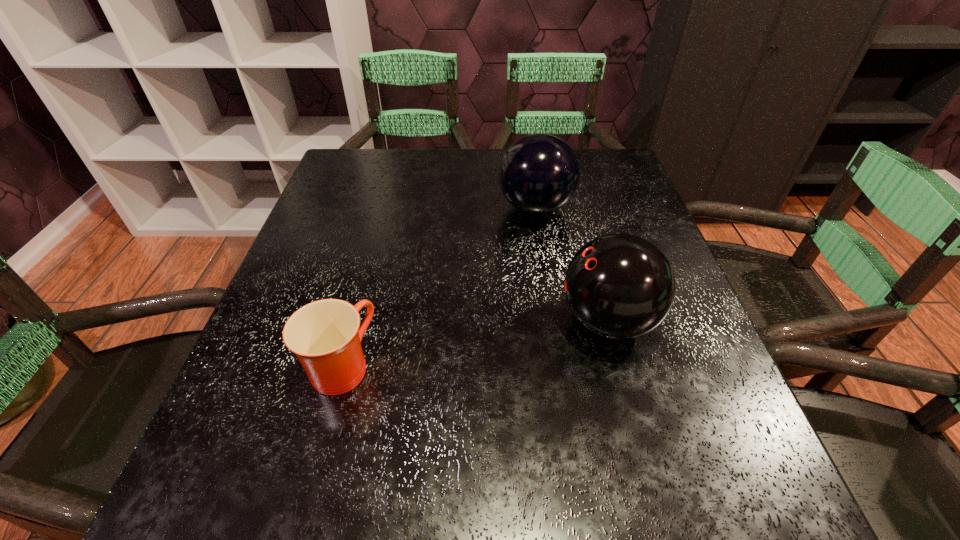
At what (x,y) coordinates should I click in order to perform the action: click on vacant area located 0.400m on the back of the leftmost object. Please return your answer as a coordinate pair (x, y). This screenshot has width=960, height=540. Looking at the image, I should click on (385, 205).

I want to click on object that is at the far edge, so click(x=539, y=173).

At what (x,y) coordinates should I click in order to perform the action: click on object that is positioned at the left edge. Please return your answer as a coordinate pair (x, y). This screenshot has width=960, height=540. Looking at the image, I should click on (325, 335).

Where is `object positioned at the right edge`? The width and height of the screenshot is (960, 540). object positioned at the right edge is located at coordinates (620, 286).

In the image, there is a desktop. Identify the location of free space at the far edge. This screenshot has height=540, width=960. (458, 169).

Locate an element on the screen. This screenshot has height=540, width=960. free space at the near edge of the desktop is located at coordinates (655, 535).

Where is `free space at the left edge of the desktop`? The height and width of the screenshot is (540, 960). free space at the left edge of the desktop is located at coordinates (345, 206).

In the image, there is a desktop. Find the location of `blank space at the right edge`. blank space at the right edge is located at coordinates (629, 234).

Image resolution: width=960 pixels, height=540 pixels. In order to click on vacant space at the far right corner of the desktop in this screenshot , I will do `click(588, 181)`.

This screenshot has height=540, width=960. In order to click on empty location between the farthest object and the cup in this screenshot , I will do `click(439, 287)`.